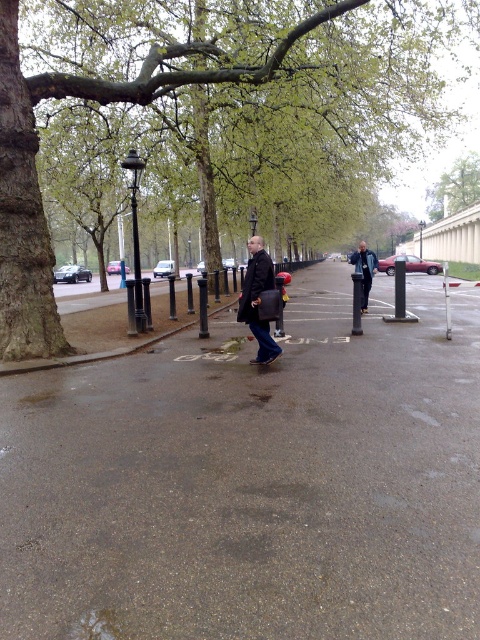
You are a pedestrian standing on the smooth asphalt pavement at center. You want to walk towards the green leafy tree at center. Is the tree in front of or behind you?

The green leafy tree at center is behind you because the smooth asphalt pavement at center is in front of it.

You are a pedestrian walking on the smooth asphalt pavement at center. You want to avoid getting wet from the rain. Since the green leafy tree at center is above you, can you stand under it to stay dry?

The smooth asphalt pavement at center is below the green leafy tree at center, so standing under the tree would place you on the pavement. However, the tree itself does not provide shelter from the rain, so you would still get wet.

You are a pedestrian standing at the edge of the wet pavement. You see a green leafy tree at center and a blue denim jacket at center. Which object is located to the left of the other?

The green leafy tree at center is positioned on the left side of blue denim jacket at center.